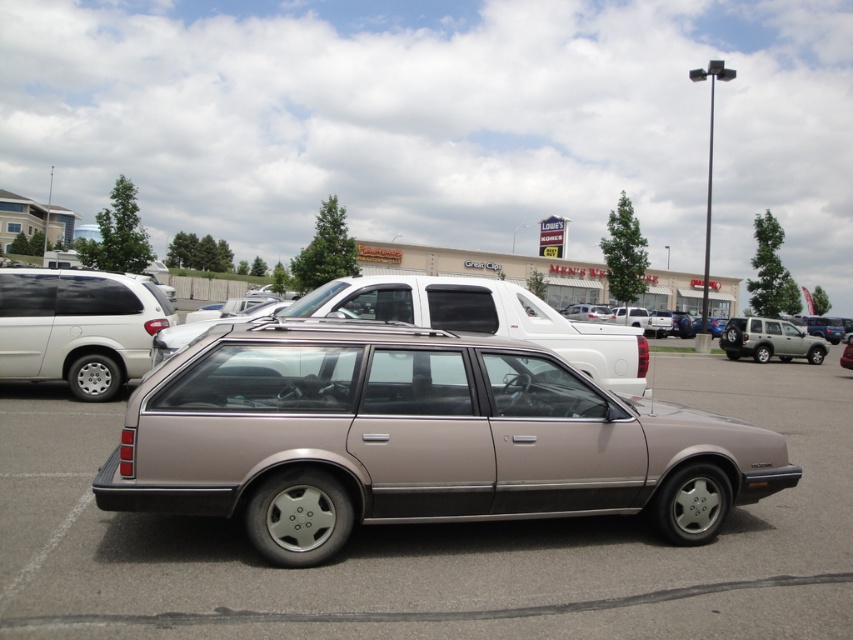
Question: Which of these objects is positioned closest to the satin silver suv at right?

Choices:
 (A) metallic gray station wagon at center
 (B) metallic gold station wagon at center
 (C) matte black minivan at left

Answer: (B)

Question: Among these points, which one is nearest to the camera?

Choices:
 (A) (769, 323)
 (B) (589, 612)
 (C) (112, 291)

Answer: (B)

Question: Considering the relative positions of matte black minivan at left and metallic gold station wagon at center in the image provided, where is matte black minivan at left located with respect to metallic gold station wagon at center?

Choices:
 (A) right
 (B) left

Answer: (B)

Question: Based on their relative distances, which object is farther from the matte black minivan at left?

Choices:
 (A) metallic gray station wagon at center
 (B) satin silver suv at right
 (C) metallic gold station wagon at center

Answer: (B)

Question: Does metallic gray station wagon at center appear on the right side of matte black minivan at left?

Choices:
 (A) no
 (B) yes

Answer: (B)

Question: Can you confirm if metallic gray station wagon at center is positioned to the right of satin silver suv at right?

Choices:
 (A) yes
 (B) no

Answer: (B)